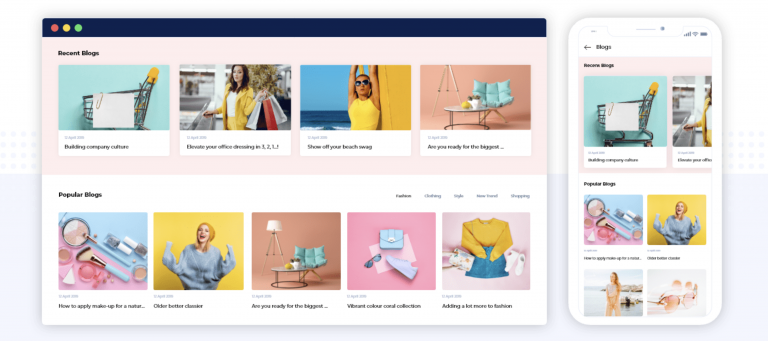
The height and width of the screenshot is (341, 768). I want to click on table, so pos(290,268).